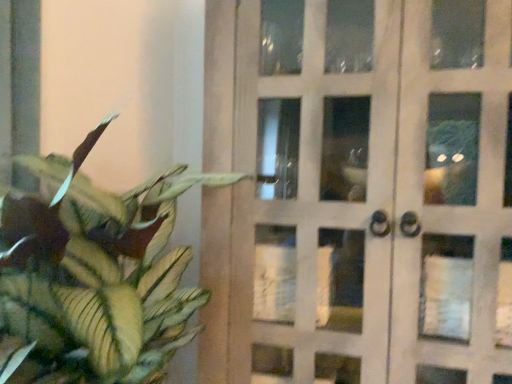
Question: Considering the relative sizes of green matte leafy plant at left and white glass door at center in the image provided, is green matte leafy plant at left taller than white glass door at center?

Choices:
 (A) yes
 (B) no

Answer: (B)

Question: Does green matte leafy plant at left come in front of white glass door at center?

Choices:
 (A) no
 (B) yes

Answer: (B)

Question: Is green matte leafy plant at left positioned with its back to white glass door at center?

Choices:
 (A) no
 (B) yes

Answer: (A)

Question: Considering the relative sizes of green matte leafy plant at left and white glass door at center in the image provided, is green matte leafy plant at left bigger than white glass door at center?

Choices:
 (A) no
 (B) yes

Answer: (A)

Question: Is the position of green matte leafy plant at left more distant than that of white glass door at center?

Choices:
 (A) yes
 (B) no

Answer: (B)

Question: Is green matte leafy plant at left located outside white glass door at center?

Choices:
 (A) yes
 (B) no

Answer: (A)

Question: Can you confirm if white glass door at center is shorter than green matte leafy plant at left?

Choices:
 (A) yes
 (B) no

Answer: (B)

Question: Is white glass door at center positioned behind green matte leafy plant at left?

Choices:
 (A) no
 (B) yes

Answer: (B)

Question: Can you confirm if white glass door at center is positioned to the left of green matte leafy plant at left?

Choices:
 (A) no
 (B) yes

Answer: (A)

Question: Does white glass door at center have a greater height compared to green matte leafy plant at left?

Choices:
 (A) yes
 (B) no

Answer: (A)

Question: Is the position of white glass door at center less distant than that of green matte leafy plant at left?

Choices:
 (A) yes
 (B) no

Answer: (B)

Question: Could you tell me if white glass door at center is facing green matte leafy plant at left?

Choices:
 (A) no
 (B) yes

Answer: (A)

Question: Is white glass door at center situated inside green matte leafy plant at left or outside?

Choices:
 (A) outside
 (B) inside

Answer: (A)